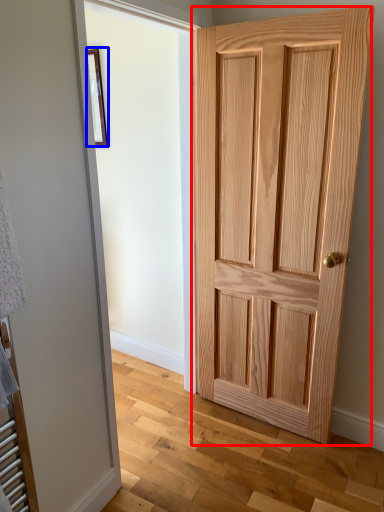
Question: Among these objects, which one is farthest to the camera, door (highlighted by a red box) or picture frame (highlighted by a blue box)?

Choices:
 (A) door
 (B) picture frame

Answer: (B)